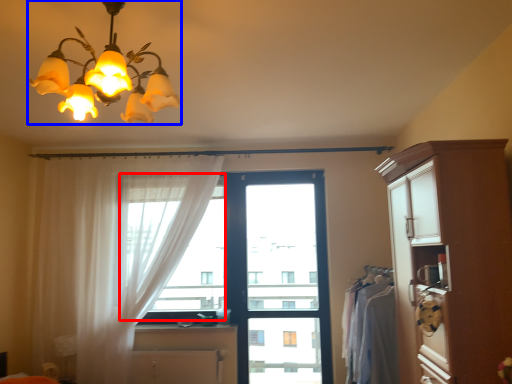
Question: Among these objects, which one is farthest to the camera, window screen (highlighted by a red box) or lamp (highlighted by a blue box)?

Choices:
 (A) window screen
 (B) lamp

Answer: (A)